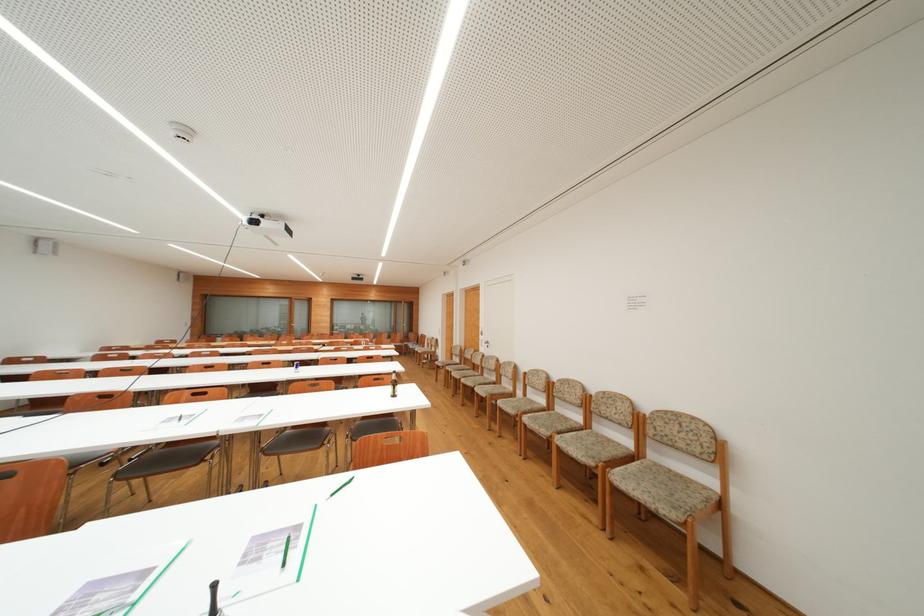
Find where to lift the brown glass bottle. Please return your answer as a coordinate pair (x, y).

(393, 385)